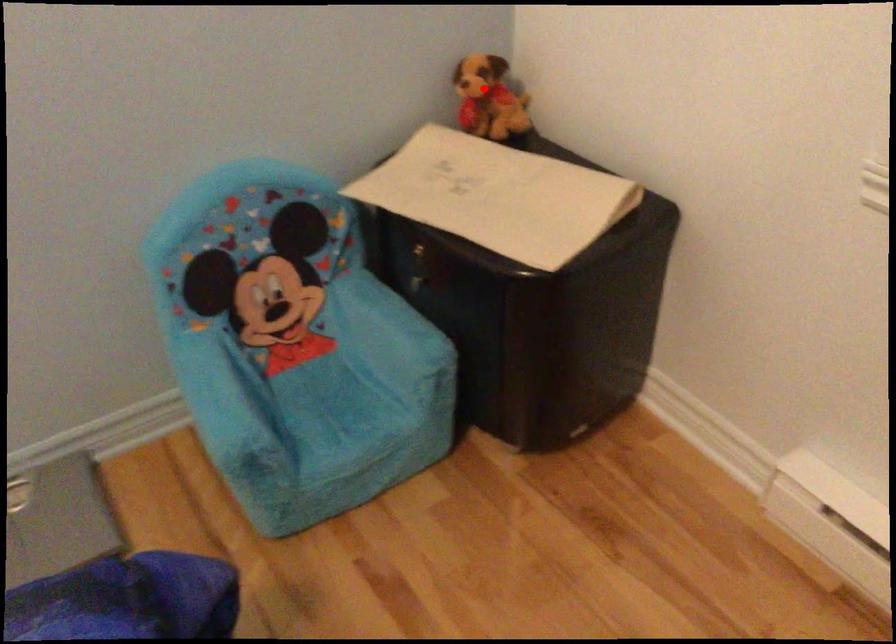
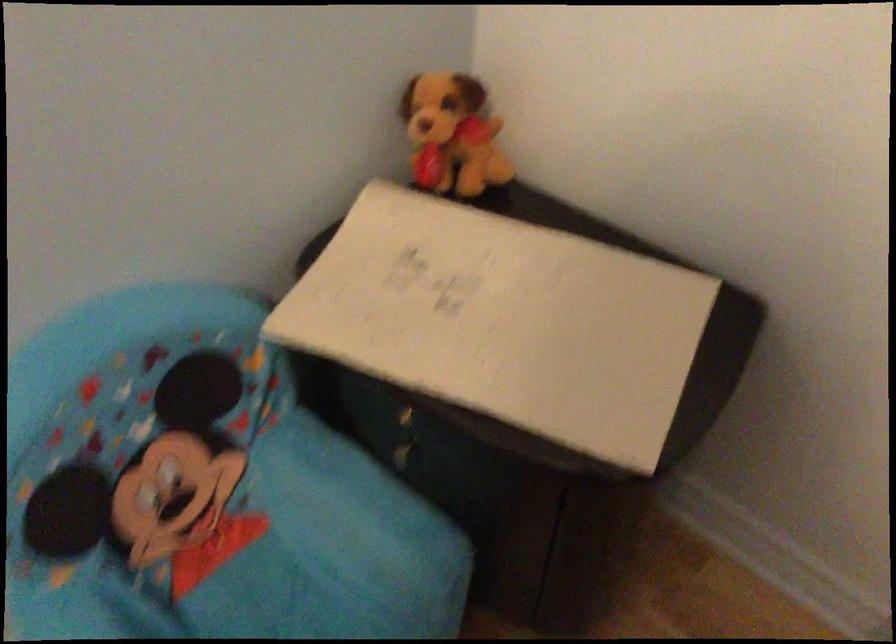
Question: A red point is marked in image1. In image2, is the corresponding 3D point closer to the camera or farther? Reply with the corresponding letter.

Choices:
 (A) The corresponding 3D point is closer.
 (B) The corresponding 3D point is farther.

Answer: (A)